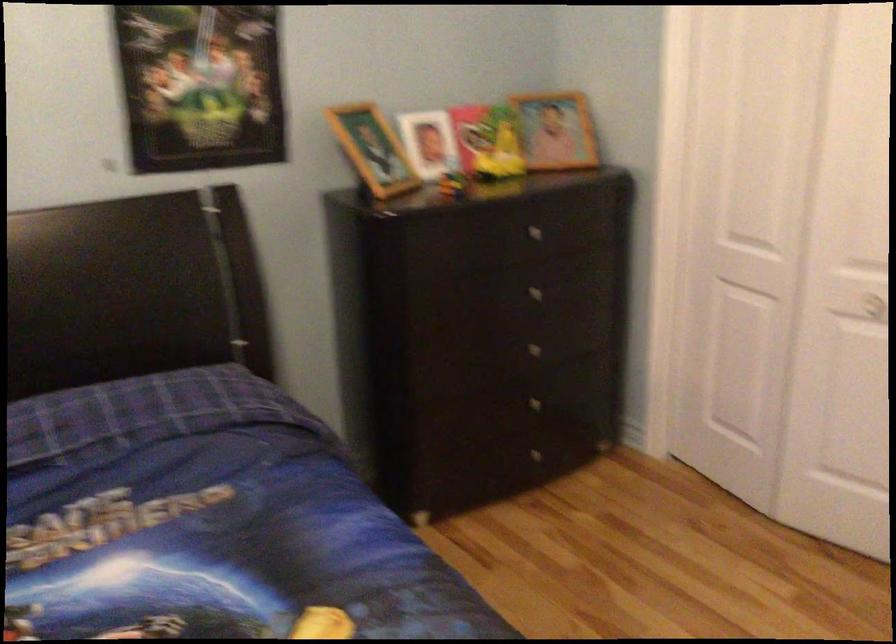
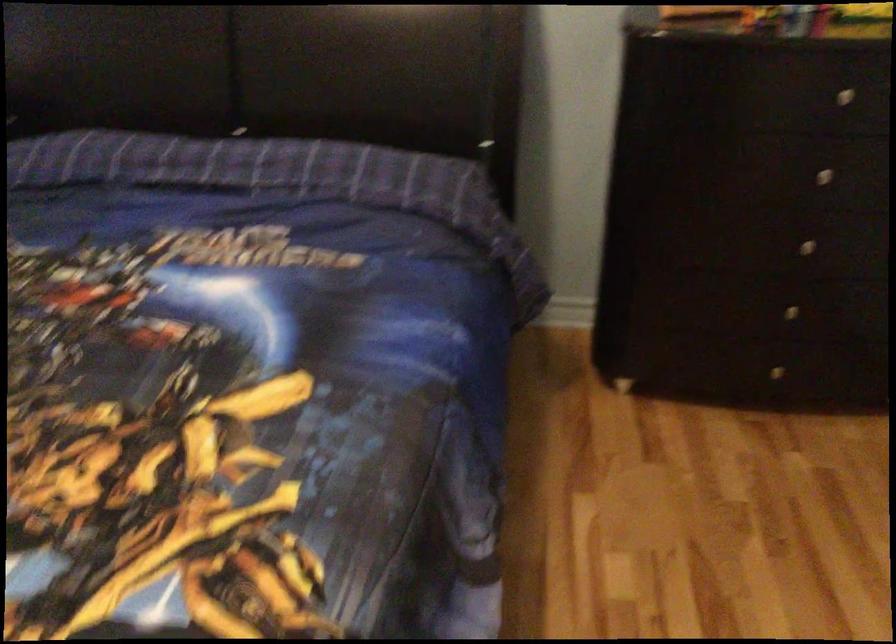
In the second image, find the point that corresponds to (538,348) in the first image.

(805, 245)